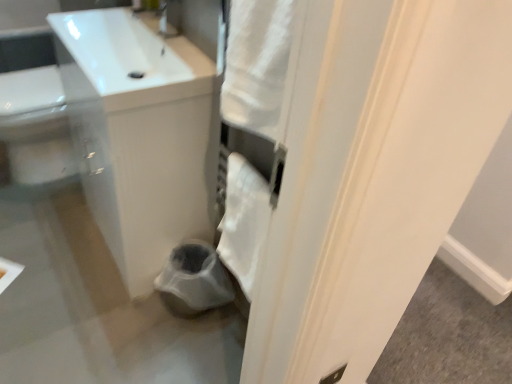
Question: Considering the relative sizes of white glossy sink at upper left and white soft towel at center in the image provided, is white glossy sink at upper left thinner than white soft towel at center?

Choices:
 (A) yes
 (B) no

Answer: (B)

Question: Is white glossy sink at upper left with white soft towel at center?

Choices:
 (A) yes
 (B) no

Answer: (B)

Question: Considering the relative positions of white glossy sink at upper left and white soft towel at center in the image provided, is white glossy sink at upper left behind white soft towel at center?

Choices:
 (A) no
 (B) yes

Answer: (A)

Question: Is the depth of white glossy sink at upper left less than that of white soft towel at center?

Choices:
 (A) yes
 (B) no

Answer: (A)

Question: Is white glossy sink at upper left at the left side of white soft towel at center?

Choices:
 (A) yes
 (B) no

Answer: (A)

Question: Is white soft towel at center located within white glossy sink at upper left?

Choices:
 (A) yes
 (B) no

Answer: (B)

Question: Is there a large distance between white soft towel at center and white glossy sink at upper left?

Choices:
 (A) yes
 (B) no

Answer: (B)

Question: Is white soft towel at center thinner than white glossy sink at upper left?

Choices:
 (A) yes
 (B) no

Answer: (A)

Question: Could you tell me if white soft towel at center is turned towards white glossy sink at upper left?

Choices:
 (A) yes
 (B) no

Answer: (B)

Question: From the image's perspective, does white soft towel at center appear higher than white glossy sink at upper left?

Choices:
 (A) no
 (B) yes

Answer: (A)

Question: Considering the relative sizes of white soft towel at center and white glossy sink at upper left in the image provided, is white soft towel at center shorter than white glossy sink at upper left?

Choices:
 (A) no
 (B) yes

Answer: (A)

Question: From a real-world perspective, is white soft towel at center physically above white glossy sink at upper left?

Choices:
 (A) no
 (B) yes

Answer: (A)

Question: Can you confirm if white glossy sink at upper left is positioned to the right of white glossy sink at upper left?

Choices:
 (A) yes
 (B) no

Answer: (A)